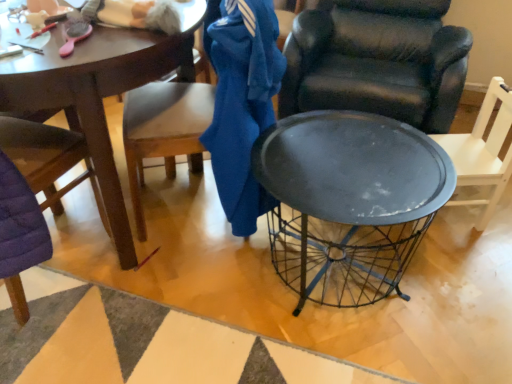
Question: In terms of size, does blue cotton jacket at center appear bigger or smaller than matte black chair at right, which ranks as the 1th chair in right-to-left order?

Choices:
 (A) big
 (B) small

Answer: (A)

Question: Is blue cotton jacket at center in front of or behind matte black chair at right, which ranks as the 1th chair in right-to-left order, in the image?

Choices:
 (A) behind
 (B) front

Answer: (B)

Question: Which is nearer to the blue cotton jacket at center?

Choices:
 (A) matte black chair at right, positioned as the fourth chair in left-to-right order
 (B) metallic wire basket at center
 (C) matte black chair at center, the 2th chair when ordered from right to left
 (D) metallic black table at center
 (E) purple quilted chair at left, marked as the 4th chair in a right-to-left arrangement

Answer: (D)

Question: Which of these objects is positioned closest to the wooden chair at left, placed as the third chair when sorted from right to left?

Choices:
 (A) metallic wire basket at center
 (B) matte black chair at center, the 2th chair when ordered from right to left
 (C) purple quilted chair at left, marked as the 4th chair in a right-to-left arrangement
 (D) matte black chair at right, which ranks as the 1th chair in right-to-left order
 (E) metallic black table at center

Answer: (A)